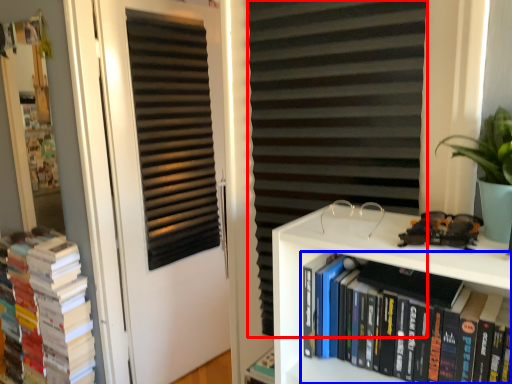
Question: Which object appears farthest to the camera in this image, curtain (highlighted by a red box) or book (highlighted by a blue box)?

Choices:
 (A) curtain
 (B) book

Answer: (A)